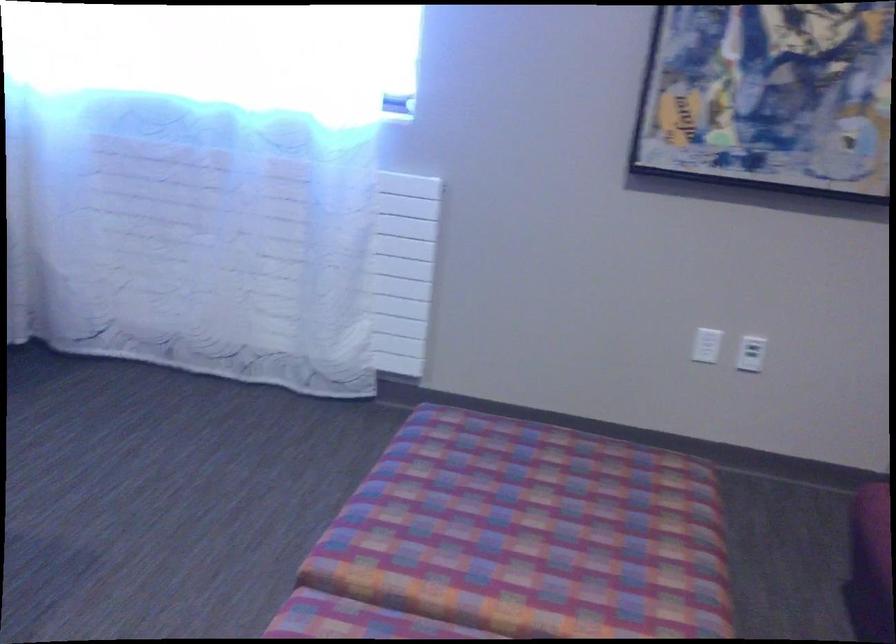
This screenshot has height=644, width=896. What do you see at coordinates (707, 345) in the screenshot? I see `the white light switch` at bounding box center [707, 345].